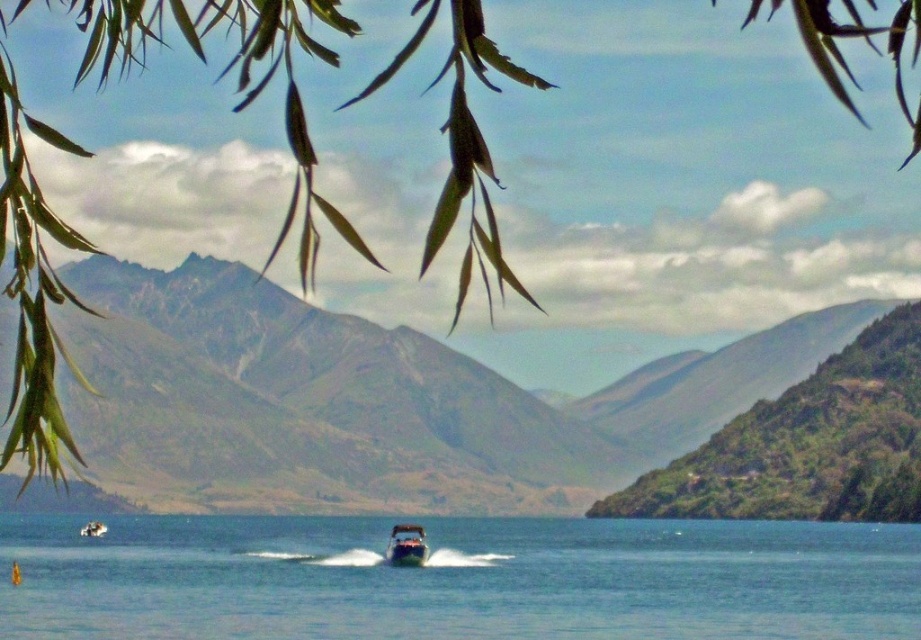
You are a photographer planning to capture the shiny metallic boat at center and the metallic silver boat at center in a single shot. Given that your camera has a limited field of view, which boat should you position closer to the center of the frame to ensure both are fully visible?

You should position the shiny metallic boat at center closer to the center of the frame because it is larger in size than the metallic silver boat at center, making it easier to fit both within the camera frame.

You are standing at the edge of the lake and want to reach the clear blue water at center. Which direction should you move in to get there?

The clear blue water at center is located at point coordinates, so you should move towards the center of the lake from the edge to reach it.

You are standing at the point labeled as point (406, 545) in the image. What object is directly in front of you?

The point (406, 545) corresponds to the shiny metallic boat at center, so the shiny metallic boat at center is directly in front of you.